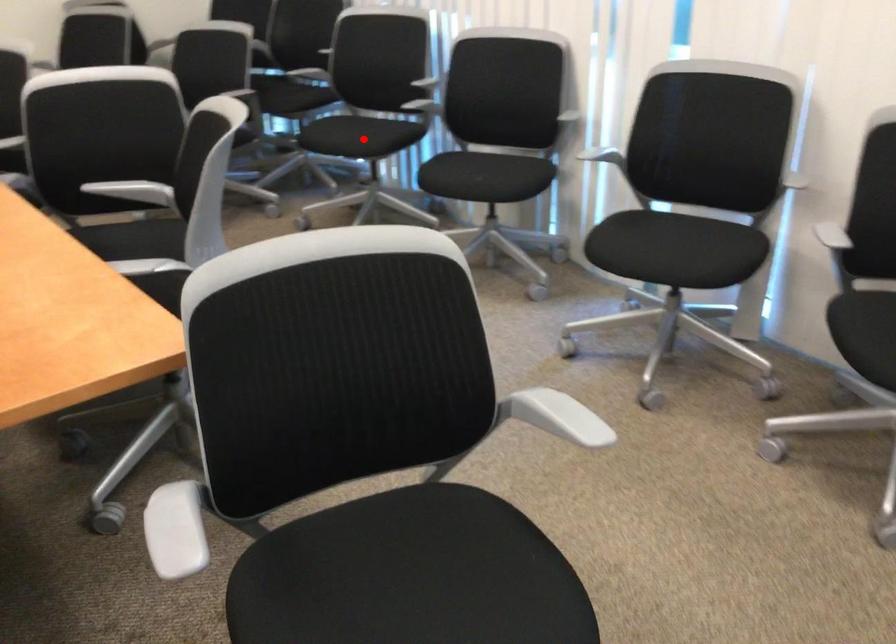
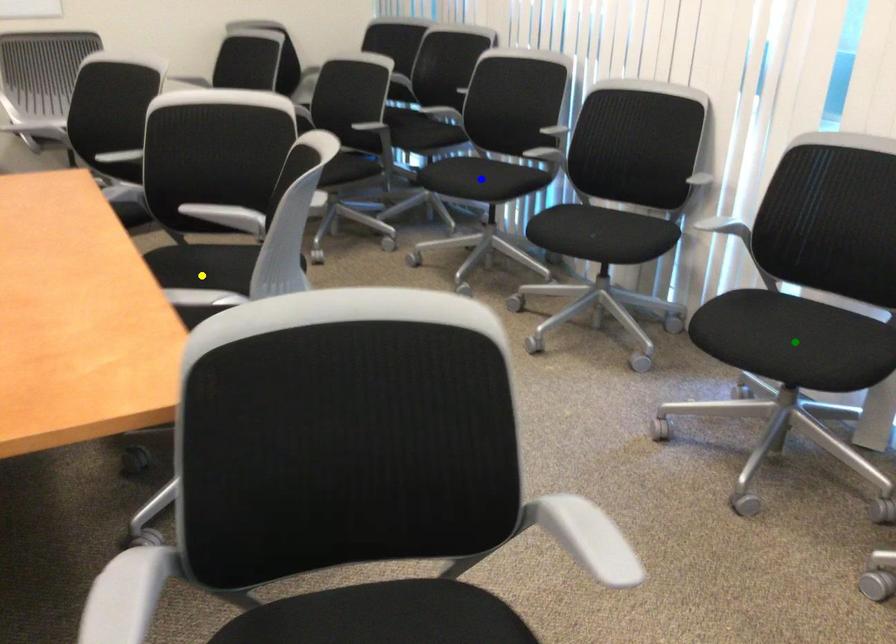
Question: I am providing you with two images of the same scene from different viewpoints. A red point is marked on the first image. You are given multiple points on the second image. Which mark in image 2 goes with the point in image 1?

Choices:
 (A) yellow point
 (B) green point
 (C) blue point

Answer: (C)